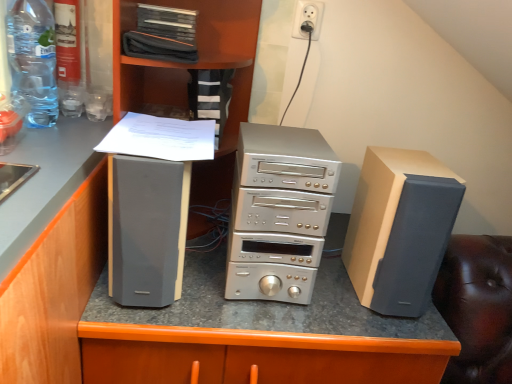
You are a GUI agent. You are given a task and a screenshot of the screen. Output one action in this format:
    pyautogui.click(x=<x>, y=<y>)
    Task: Click on the empty space that is in between silver metallic stereo stack at center and matte beige computer tower at right
    The image size is (512, 384).
    Given the screenshot: What is the action you would take?
    pyautogui.click(x=332, y=293)